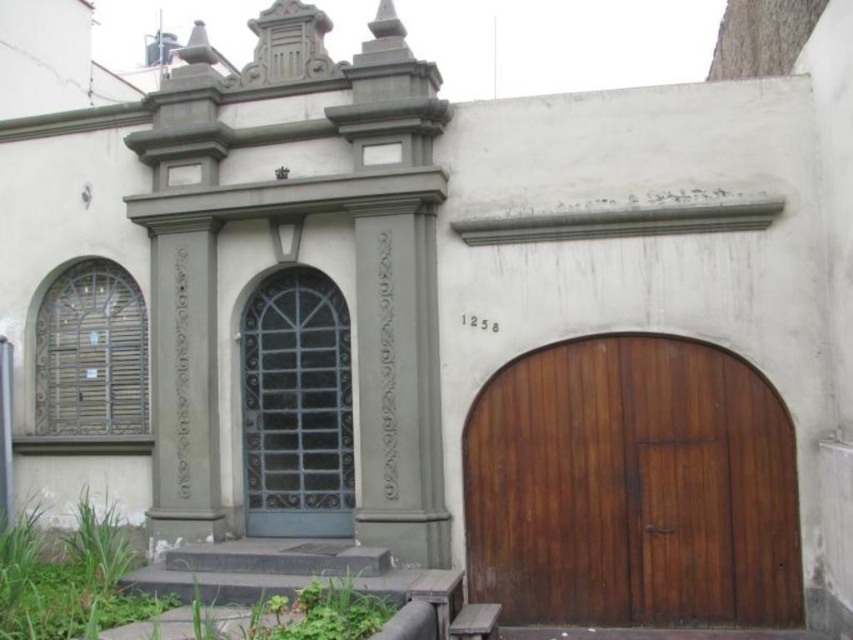
Looking at this image, you are a delivery person trying to load a tall package into the building through one of the doors. The package is exactly the height of the matte gray door at center. Can you fit the package through the dark brown wood garage door at center?

The dark brown wood garage door at center is not as tall as the matte gray door at center, so the package, which is as tall as the matte gray door at center, will not fit through the dark brown wood garage door at center.

You are a delivery person trying to enter the building. You see the dark brown wood garage door at center and the matte gray door at center. Which door should you use to enter the building?

The matte gray door at center is the correct entrance because the dark brown wood garage door at center is positioned under it, indicating it might be a lower level or garage access.

You are a delivery person standing at the entrance of the building. You need to place a camera 7.5 meters away from the dark brown wood garage door at center. Is the camera placed correctly according to the distance requirement?

The dark brown wood garage door at center and camera are 7.53 meters apart, so the camera is placed correctly as it meets the 7.5 meters distance requirement.